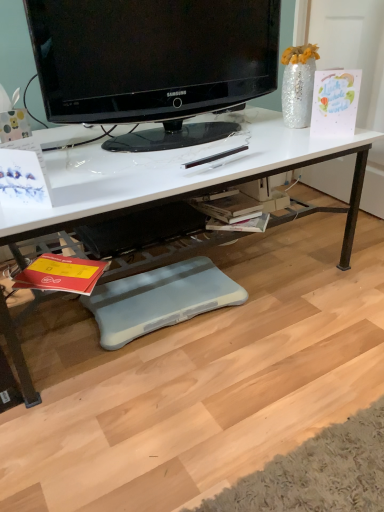
The image size is (384, 512). Find the location of `free space in front of black glossy television at upper center`. free space in front of black glossy television at upper center is located at coordinates pyautogui.click(x=162, y=166).